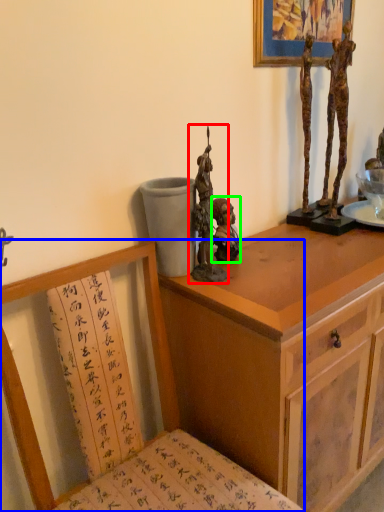
Question: Which object is positioned closest to sculpture (highlighted by a red box)? Select from chair (highlighted by a blue box) and person (highlighted by a green box).

Choices:
 (A) chair
 (B) person

Answer: (B)